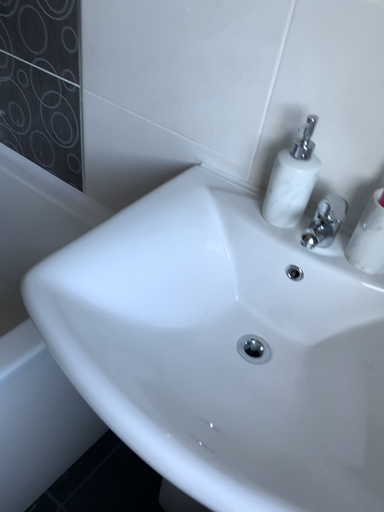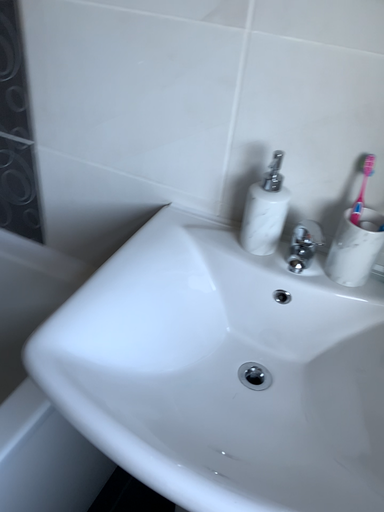
Question: How did the camera likely rotate when shooting the video?

Choices:
 (A) rotated left
 (B) rotated right

Answer: (B)